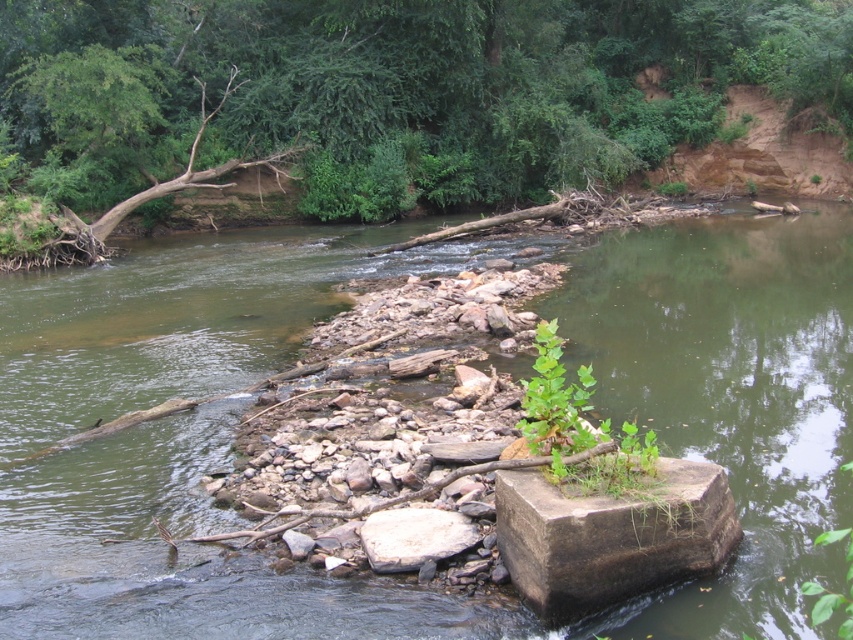
Question: Which object is the farthest from the brown concrete block at center?

Choices:
 (A) brown wood log at upper center
 (B) green stone at center
 (C) white smooth rock at center

Answer: (A)

Question: Which point is farther from the camera taking this photo?

Choices:
 (A) (21, 124)
 (B) (650, 538)
 (C) (196, 296)

Answer: (A)

Question: Which point is farther from the camera taking this photo?

Choices:
 (A) (259, 273)
 (B) (383, 570)
 (C) (218, 0)

Answer: (C)

Question: Is green stone at center positioned in front of brown wood log at upper center?

Choices:
 (A) no
 (B) yes

Answer: (B)

Question: Can you confirm if brown wood log at upper center is positioned to the right of brown concrete block at center?

Choices:
 (A) no
 (B) yes

Answer: (B)

Question: Does green stone at center have a greater width compared to white smooth rock at center?

Choices:
 (A) yes
 (B) no

Answer: (A)